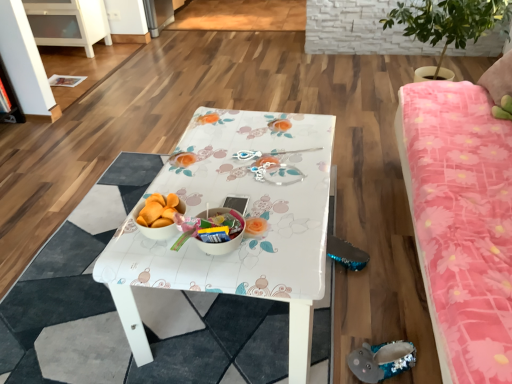
Question: Considering the relative sizes of white glossy bowl at center and sequined gray slipper at lower right in the image provided, is white glossy bowl at center smaller than sequined gray slipper at lower right?

Choices:
 (A) yes
 (B) no

Answer: (B)

Question: Considering the relative sizes of white glossy bowl at center and sequined gray slipper at lower right in the image provided, is white glossy bowl at center thinner than sequined gray slipper at lower right?

Choices:
 (A) yes
 (B) no

Answer: (A)

Question: Is white glossy bowl at center turned away from sequined gray slipper at lower right?

Choices:
 (A) yes
 (B) no

Answer: (B)

Question: Is the surface of white glossy bowl at center in direct contact with sequined gray slipper at lower right?

Choices:
 (A) no
 (B) yes

Answer: (A)

Question: Is white glossy bowl at center wider than sequined gray slipper at lower right?

Choices:
 (A) yes
 (B) no

Answer: (B)

Question: Does white glossy bowl at center have a lesser height compared to sequined gray slipper at lower right?

Choices:
 (A) yes
 (B) no

Answer: (B)

Question: From the image's perspective, is green leafy plant at upper right beneath white glossy cabinet at upper left?

Choices:
 (A) no
 (B) yes

Answer: (B)

Question: Is green leafy plant at upper right smaller than white glossy cabinet at upper left?

Choices:
 (A) no
 (B) yes

Answer: (A)

Question: Is green leafy plant at upper right positioned behind white glossy cabinet at upper left?

Choices:
 (A) yes
 (B) no

Answer: (B)

Question: Is green leafy plant at upper right oriented towards white glossy cabinet at upper left?

Choices:
 (A) no
 (B) yes

Answer: (B)

Question: From the image's perspective, does green leafy plant at upper right appear higher than white glossy cabinet at upper left?

Choices:
 (A) no
 (B) yes

Answer: (A)

Question: Is green leafy plant at upper right not near white glossy cabinet at upper left?

Choices:
 (A) yes
 (B) no

Answer: (A)

Question: Is pink floral fabric studio couch at right closer to the viewer compared to green leafy plant at upper right?

Choices:
 (A) no
 (B) yes

Answer: (B)